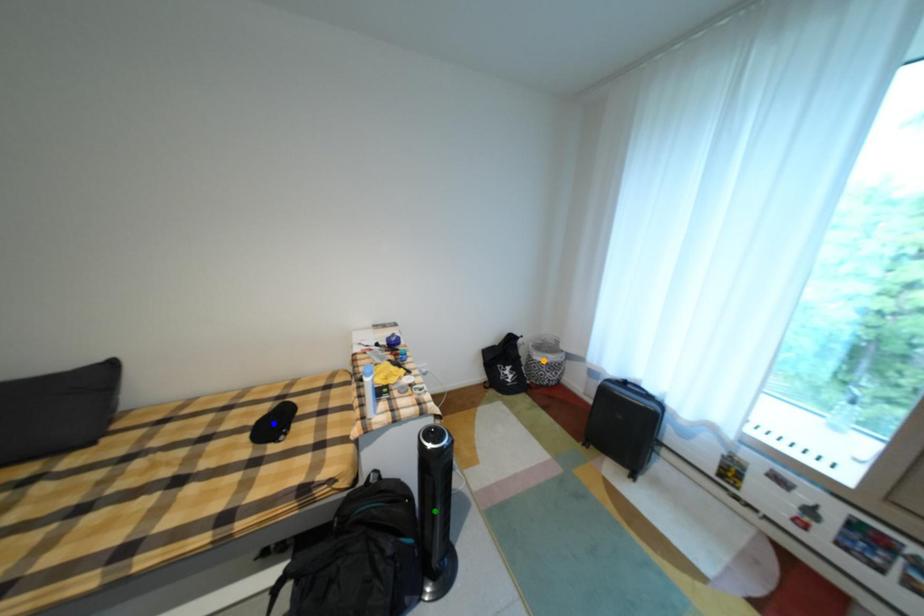
Order these from nearest to farthest:
blue point | orange point | green point

orange point → blue point → green point